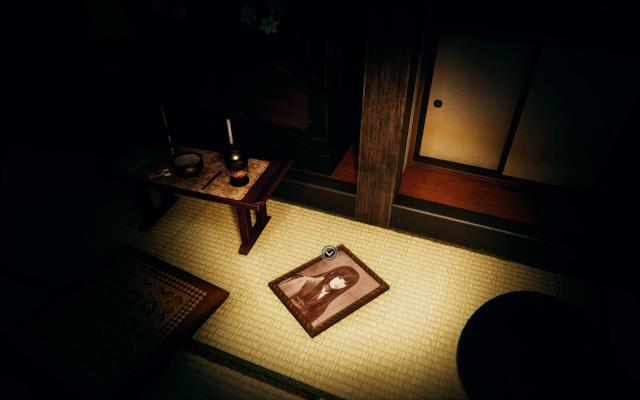
Where is `wood wall`? This screenshot has height=400, width=640. wood wall is located at coordinates (381, 99).